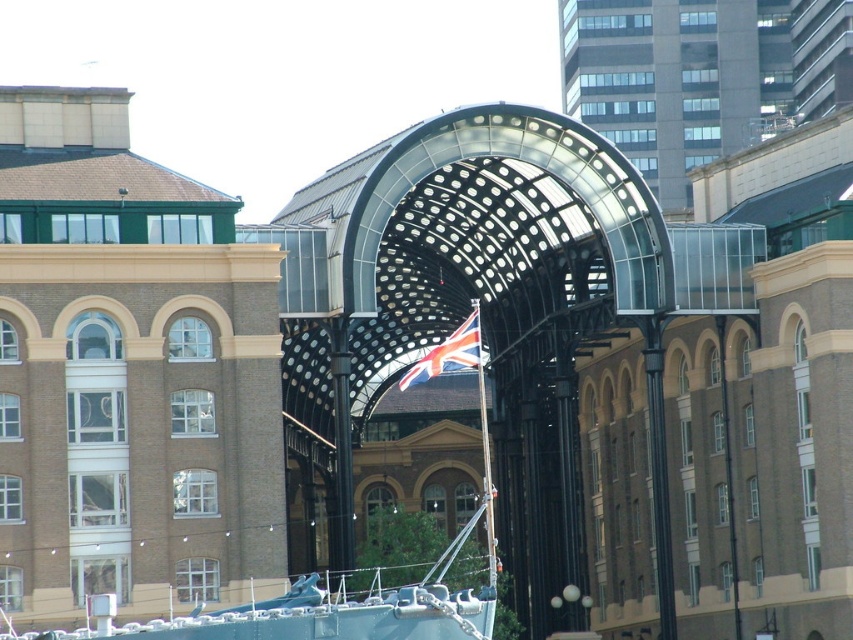
Does teal fabric boat at center have a larger size compared to union jack fabric at center?

Correct, teal fabric boat at center is larger in size than union jack fabric at center.

Can you confirm if teal fabric boat at center is smaller than union jack fabric at center?

No, teal fabric boat at center is not smaller than union jack fabric at center.

Is point (221, 628) more distant than point (480, 353)?

That is False.

The height and width of the screenshot is (640, 853). I want to click on teal fabric boat at center, so click(328, 604).